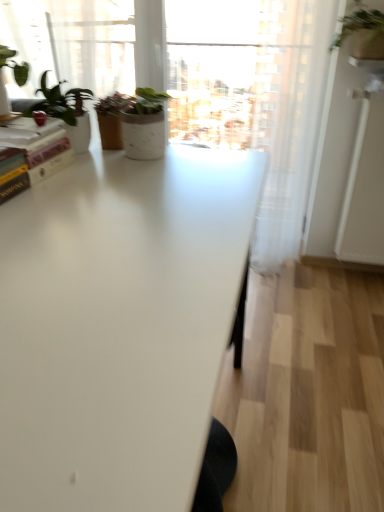
Question: Looking at their shapes, would you say green matte plant pot at upper left is wider or thinner than white glossy screen door at right?

Choices:
 (A) wide
 (B) thin

Answer: (A)

Question: From the image's perspective, is green matte plant pot at upper left positioned above or below white glossy screen door at right?

Choices:
 (A) above
 (B) below

Answer: (A)

Question: Which is nearer to the white glossy screen door at right?

Choices:
 (A) white glossy table at center
 (B) green matte plant at upper right
 (C) hardcover book at upper left
 (D) transparent glass window at upper center
 (E) green matte plant pot at upper left

Answer: (B)

Question: Based on their relative distances, which object is nearer to the green matte plant at upper right?

Choices:
 (A) transparent glass window at upper center
 (B) hardcover book at upper left
 (C) green matte plant pot at upper left
 (D) white glossy screen door at right
 (E) white glossy table at center

Answer: (D)